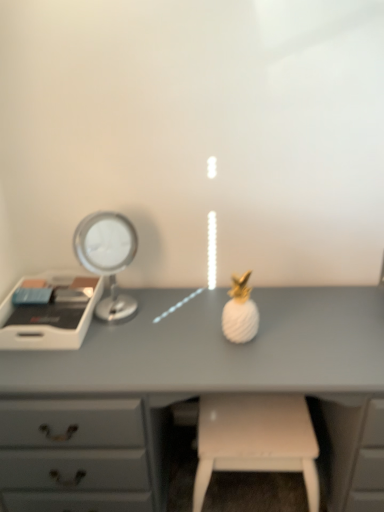
Question: Considering the positions of matte gray desk at center and white matte stool at lower center in the image, is matte gray desk at center bigger or smaller than white matte stool at lower center?

Choices:
 (A) small
 (B) big

Answer: (B)

Question: From a real-world perspective, is matte gray desk at center above or below white matte stool at lower center?

Choices:
 (A) below
 (B) above

Answer: (B)

Question: Which object is positioned closest to the matte gray desk at center?

Choices:
 (A) silver metallic mirror at left
 (B) white plastic tray at left
 (C) white matte stool at lower center

Answer: (C)

Question: Considering the real-world distances, which object is farthest from the white plastic tray at left?

Choices:
 (A) matte gray desk at center
 (B) white matte stool at lower center
 (C) silver metallic mirror at left

Answer: (B)